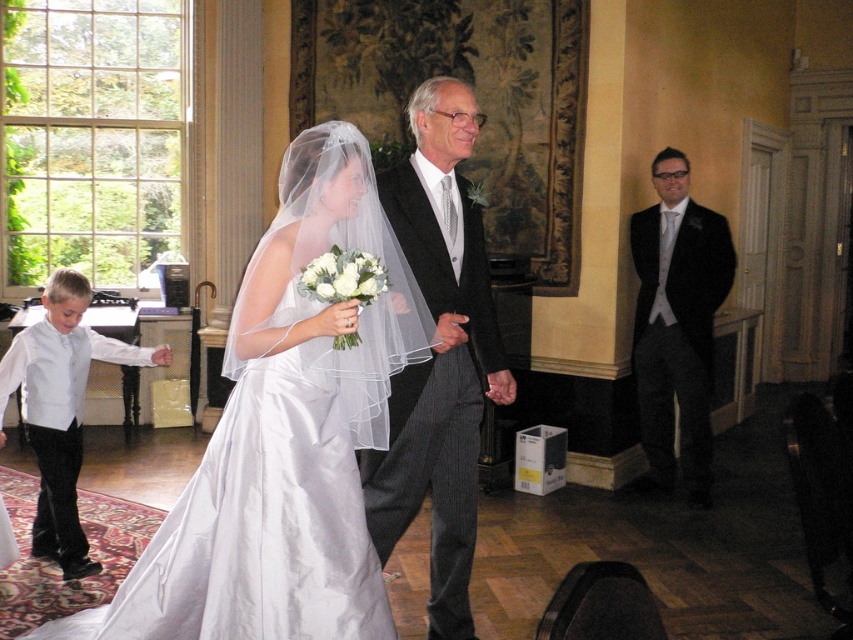
You are a photographer standing at the back of the room. You want to take a photo that includes both the satin dress at center and the matte black suit at right. What is the minimum distance you need to move forward to ensure both are in frame?

The satin dress at center and the matte black suit at right are 2.68 meters apart. To include both in the frame, you need to move forward until your camera can capture a width of at least 2.68 meters. The exact distance depends on your camera lens, but the minimum distance would be when the camera lens is positioned close enough to encompass both objects within the field of view.

You are a photographer positioned at the back of the room. You need to capture a photo of the satin dress at center and the matte black suit at right. Based on their positions, which object should you focus on first if you want to include both in the frame without moving the camera?

The satin dress at center is to the left of matte black suit at right, so you should focus on the satin dress at center first to ensure both are in the frame.

You are a photographer at the wedding and want to capture a photo of the satin dress at center and dark gray pinstripe suit at center. Based on their positions, which one is lower in the image?

The satin dress at center is located below dark gray pinstripe suit at center, so the satin dress at center is lower in the image.